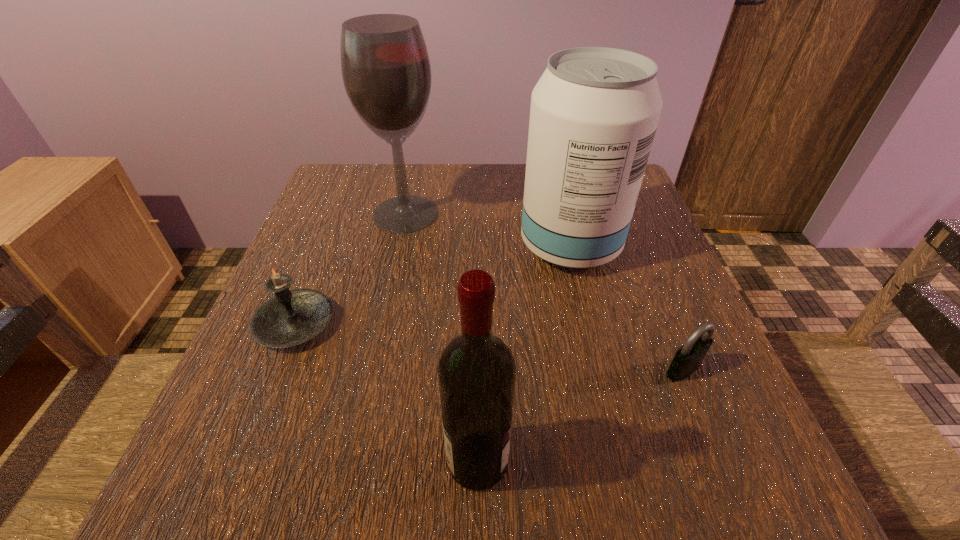
In the image, there is a desktop. Find the location of `vacant space at the far edge`. vacant space at the far edge is located at coordinates (466, 177).

You are a GUI agent. You are given a task and a screenshot of the screen. Output one action in this format:
    pyautogui.click(x=<x>, y=<y>)
    Task: Click on the free point at the near edge
    
    Given the screenshot: What is the action you would take?
    pyautogui.click(x=330, y=458)

Where is `free region at the left edge`? free region at the left edge is located at coordinates (304, 271).

The image size is (960, 540). In order to click on vacant area at the right edge of the desktop in this screenshot , I will do `click(643, 244)`.

Find the location of a particular element. free region at the near left corner is located at coordinates (276, 498).

You are a GUI agent. You are given a task and a screenshot of the screen. Output one action in this format:
    pyautogui.click(x=<x>, y=<y>)
    Task: Click on the free space that is in between the second alcohol from left to right and the shortest object
    This screenshot has height=540, width=960.
    Given the screenshot: What is the action you would take?
    pyautogui.click(x=581, y=415)

This screenshot has height=540, width=960. I want to click on unoccupied area between the leftmost alcohol and the padlock, so click(544, 292).

Where is `unoccupied position between the fourth object from right to left and the third object from right to left`? This screenshot has height=540, width=960. unoccupied position between the fourth object from right to left and the third object from right to left is located at coordinates point(442,338).

The width and height of the screenshot is (960, 540). Find the location of `vacant region between the leftmost alcohol and the third nearest object`. vacant region between the leftmost alcohol and the third nearest object is located at coordinates (350, 269).

This screenshot has height=540, width=960. What are the coordinates of `free point between the second shortest object and the leftmost alcohol` in the screenshot? It's located at (350, 269).